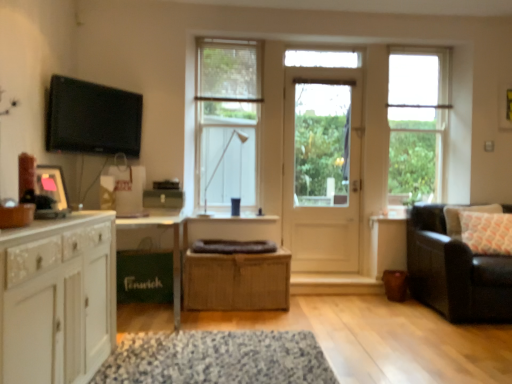
Question: Are white wooden door at center and leather couch at right far apart?

Choices:
 (A) no
 (B) yes

Answer: (B)

Question: From the image's perspective, is white wooden door at center below leather couch at right?

Choices:
 (A) no
 (B) yes

Answer: (A)

Question: From a real-world perspective, is white wooden door at center on top of leather couch at right?

Choices:
 (A) yes
 (B) no

Answer: (A)

Question: Considering the relative sizes of white wooden door at center and leather couch at right in the image provided, is white wooden door at center bigger than leather couch at right?

Choices:
 (A) yes
 (B) no

Answer: (B)

Question: Does white wooden door at center have a lesser width compared to leather couch at right?

Choices:
 (A) no
 (B) yes

Answer: (B)

Question: Is clear glass window at center, marked as the 2th window in a right-to-left arrangement, bigger or smaller than flat screen tv at upper left?

Choices:
 (A) small
 (B) big

Answer: (B)

Question: Is clear glass window at center, which is counted as the 1th window, starting from the left, wider or thinner than flat screen tv at upper left?

Choices:
 (A) wide
 (B) thin

Answer: (A)

Question: Is clear glass window at center, marked as the 2th window in a right-to-left arrangement, spatially inside flat screen tv at upper left, or outside of it?

Choices:
 (A) inside
 (B) outside

Answer: (B)

Question: Considering the positions of point (254, 102) and point (139, 120), is point (254, 102) closer or farther from the camera than point (139, 120)?

Choices:
 (A) farther
 (B) closer

Answer: (A)

Question: Considering the relative positions of bamboo cabinet at center, acting as the first cabinetry starting from the back, and speckled fabric mat at center in the image provided, is bamboo cabinet at center, acting as the first cabinetry starting from the back, to the left or to the right of speckled fabric mat at center?

Choices:
 (A) right
 (B) left

Answer: (A)

Question: Looking at the image, does bamboo cabinet at center, arranged as the second cabinetry when viewed from the front, seem bigger or smaller compared to speckled fabric mat at center?

Choices:
 (A) small
 (B) big

Answer: (B)

Question: In terms of width, does bamboo cabinet at center, acting as the first cabinetry starting from the back, look wider or thinner when compared to speckled fabric mat at center?

Choices:
 (A) wide
 (B) thin

Answer: (B)

Question: Is point (281, 264) closer or farther from the camera than point (293, 379)?

Choices:
 (A) farther
 (B) closer

Answer: (A)

Question: Is matte black picture frame at left bigger or smaller than white wooden door at center?

Choices:
 (A) big
 (B) small

Answer: (B)

Question: Choose the correct answer: Is matte black picture frame at left inside white wooden door at center or outside it?

Choices:
 (A) outside
 (B) inside

Answer: (A)